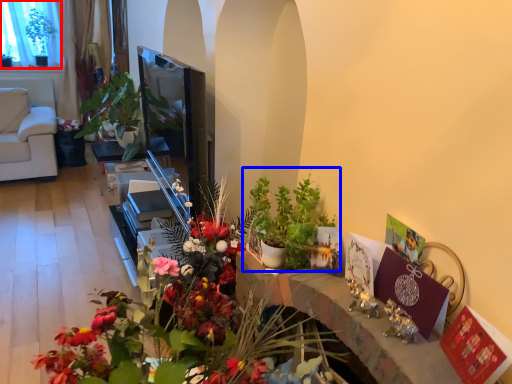
Question: Which object is closer to the camera taking this photo, window screen (highlighted by a red box) or houseplant (highlighted by a blue box)?

Choices:
 (A) window screen
 (B) houseplant

Answer: (B)